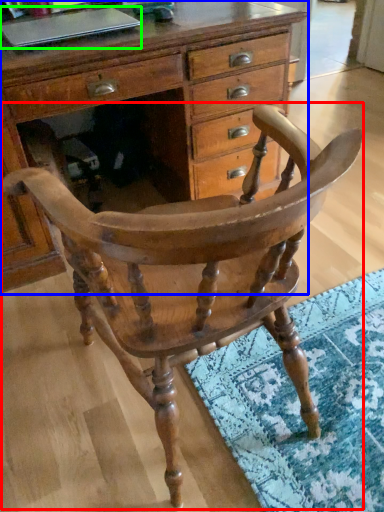
Question: Which object is positioned farthest from chair (highlighted by a red box)? Select from chest of drawers (highlighted by a blue box) and laptop (highlighted by a green box).

Choices:
 (A) chest of drawers
 (B) laptop

Answer: (B)